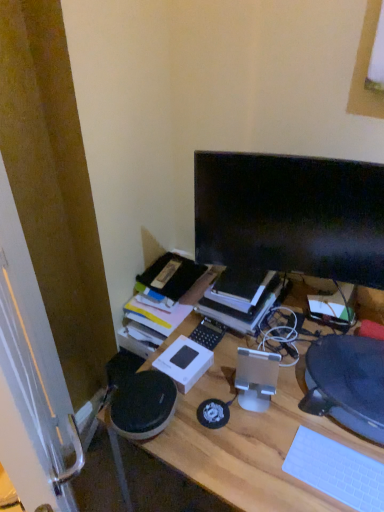
At what (x,y) coordinates should I click in order to perform the action: click on vacant region below white matte keyboard at lower right (from a real-world perspective). Please return your answer as a coordinate pair (x, y). The image size is (384, 512). Looking at the image, I should click on (340, 475).